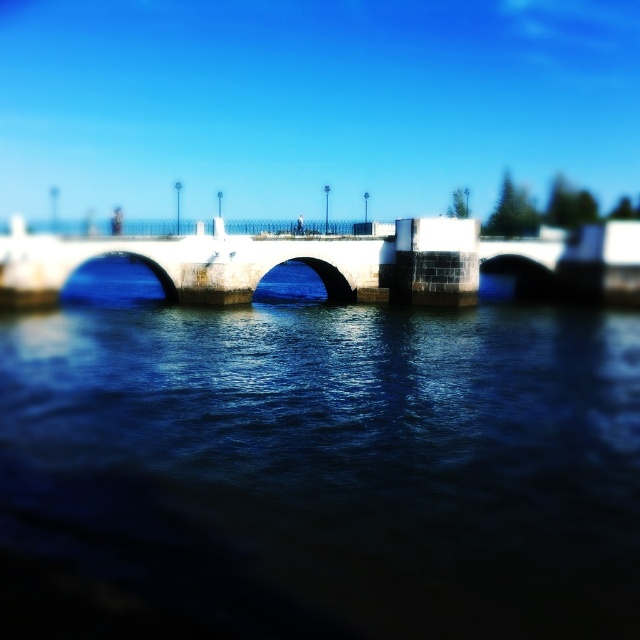
Is dark blue water at center taller than white stone bridge at center?

In fact, dark blue water at center may be shorter than white stone bridge at center.

Can you confirm if dark blue water at center is shorter than white stone bridge at center?

Indeed, dark blue water at center has a lesser height compared to white stone bridge at center.

I want to click on dark blue water at center, so click(330, 461).

At what (x,y) coordinates should I click in order to perform the action: click on dark blue water at center. Please return your answer as a coordinate pair (x, y). The width and height of the screenshot is (640, 640). Looking at the image, I should click on (330, 461).